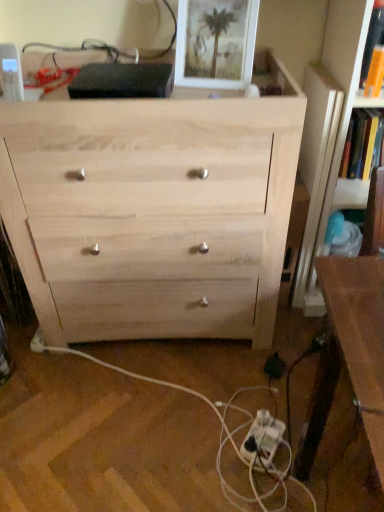
Question: Considering the relative sizes of black plastic electric outlet at lower right and brown wooden table at right in the image provided, is black plastic electric outlet at lower right shorter than brown wooden table at right?

Choices:
 (A) no
 (B) yes

Answer: (B)

Question: Is black plastic electric outlet at lower right behind brown wooden table at right?

Choices:
 (A) yes
 (B) no

Answer: (A)

Question: Is black plastic electric outlet at lower right not inside brown wooden table at right?

Choices:
 (A) yes
 (B) no

Answer: (A)

Question: From the image's perspective, is black plastic electric outlet at lower right above brown wooden table at right?

Choices:
 (A) no
 (B) yes

Answer: (A)

Question: Is black plastic electric outlet at lower right bigger than brown wooden table at right?

Choices:
 (A) yes
 (B) no

Answer: (B)

Question: Does black plastic electric outlet at lower right have a greater width compared to brown wooden table at right?

Choices:
 (A) no
 (B) yes

Answer: (A)

Question: From a real-world perspective, is brown wooden table at right on top of natural wood chest of drawers at center?

Choices:
 (A) no
 (B) yes

Answer: (A)

Question: Is brown wooden table at right oriented towards natural wood chest of drawers at center?

Choices:
 (A) yes
 (B) no

Answer: (B)

Question: Can you confirm if brown wooden table at right is smaller than natural wood chest of drawers at center?

Choices:
 (A) yes
 (B) no

Answer: (A)

Question: Would you say natural wood chest of drawers at center is part of brown wooden table at right's contents?

Choices:
 (A) no
 (B) yes

Answer: (A)

Question: Can you confirm if brown wooden table at right is positioned to the left of natural wood chest of drawers at center?

Choices:
 (A) no
 (B) yes

Answer: (A)

Question: From the image's perspective, is brown wooden table at right on top of natural wood chest of drawers at center?

Choices:
 (A) no
 (B) yes

Answer: (A)

Question: From a real-world perspective, is orange paper book at upper right, acting as the second book starting from the back, located beneath white matte picture frame at upper center?

Choices:
 (A) no
 (B) yes

Answer: (B)